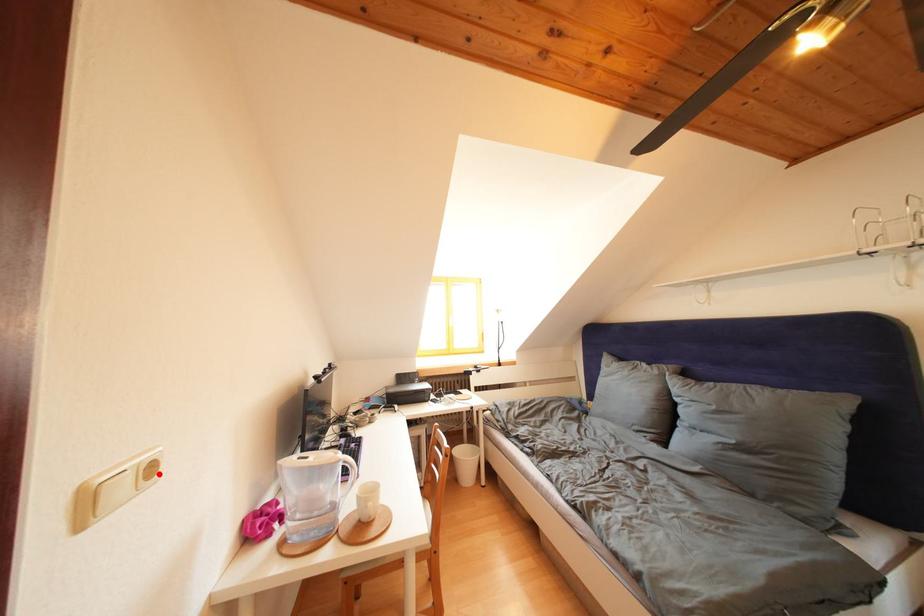
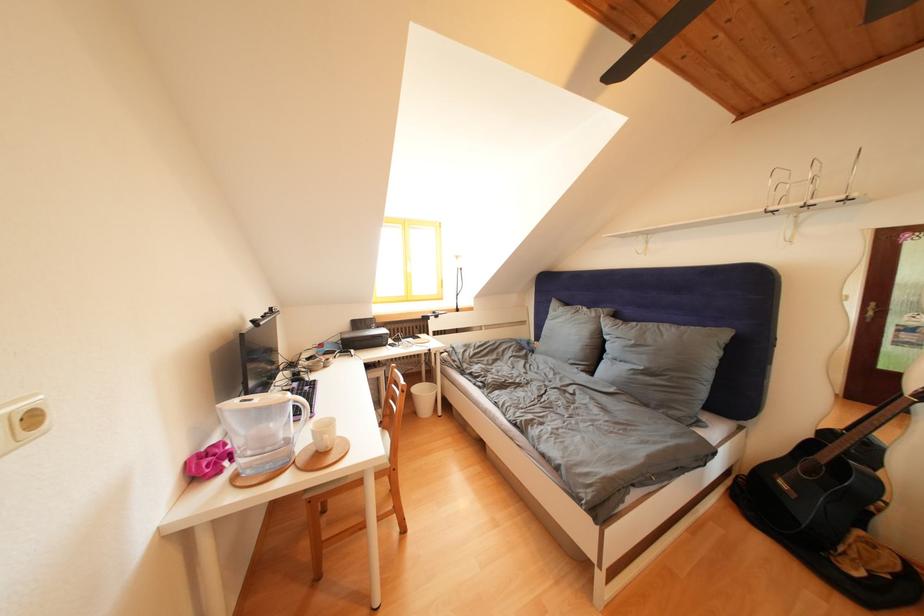
Where in the second image is the point corresponding to the highlighted location from the first image?

(41, 424)